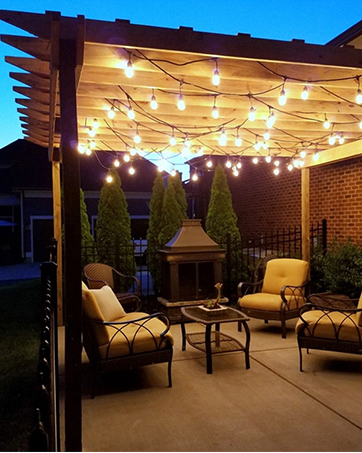
You are a GUI agent. You are given a task and a screenshot of the screen. Output one action in this format:
    pyautogui.click(x=<x>, y=<y>)
    Task: Click on the lights
    The height and width of the screenshot is (453, 362).
    Given the screenshot: What is the action you would take?
    pyautogui.click(x=152, y=108), pyautogui.click(x=160, y=62), pyautogui.click(x=238, y=138), pyautogui.click(x=266, y=150), pyautogui.click(x=336, y=121), pyautogui.click(x=275, y=166)